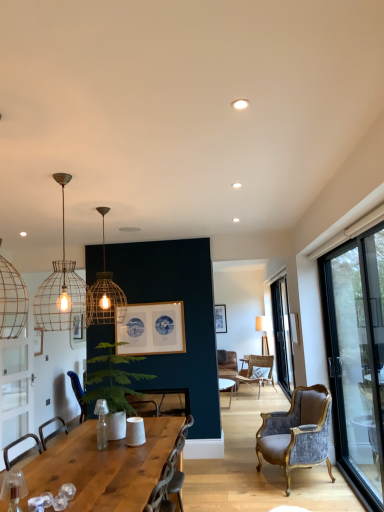
Question: From a real-world perspective, is transparent glass door at right, marked as the first window in a back-to-front arrangement, physically located above or below metal wire pendant light at upper left, positioned as the second lamp in back-to-front order?

Choices:
 (A) above
 (B) below

Answer: (B)

Question: From the image's perspective, is transparent glass door at right, which is the second window in front-to-back order, above or below metal wire pendant light at upper left, positioned as the second lamp in back-to-front order?

Choices:
 (A) below
 (B) above

Answer: (A)

Question: Estimate the real-world distances between objects in this image. Which object is farther from the wooden chair at center, the first chair viewed from the left?

Choices:
 (A) green leafy plant at center
 (B) rattan chair at center, placed as the 1th chair when sorted from right to left
 (C) white matte recessed light at upper center
 (D) matte gold wire cage pendant light at upper center, acting as the second lamp starting from the front
 (E) matte wooden picture frame at upper center, the 1th picture frame positioned from the back

Answer: (B)

Question: Which object is the farthest from the white matte recessed light at upper center?

Choices:
 (A) green leafy plant at center
 (B) wooden framed picture at center, which is the second picture frame from back to front
 (C) transparent glass door at right, which is the second window in front-to-back order
 (D) rattan chair at center, which is the 1th chair from back to front
 (E) wooden table at center

Answer: (D)